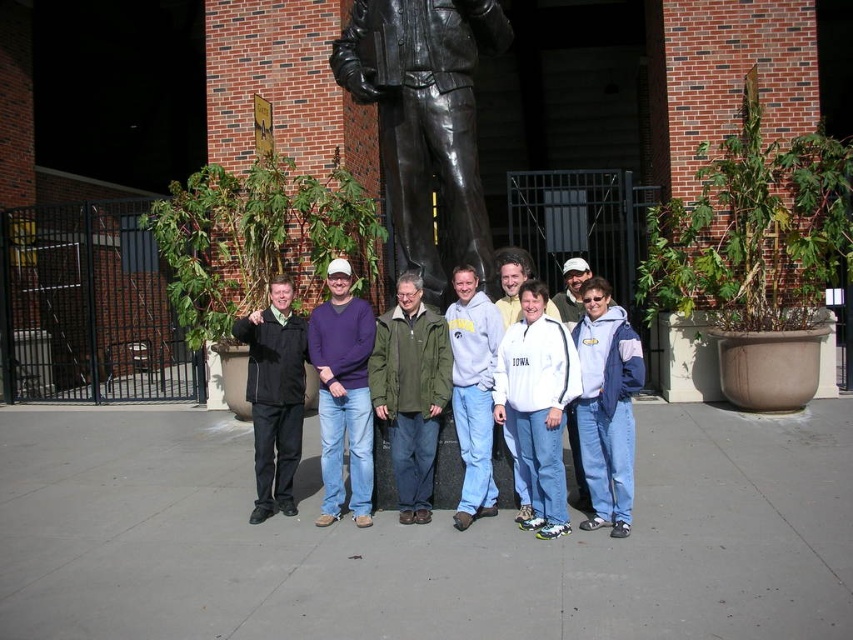
Question: Is white fleece jacket at center thinner than purple sweater at center?

Choices:
 (A) yes
 (B) no

Answer: (A)

Question: Based on their relative distances, which object is farther from the purple sweater at center?

Choices:
 (A) black matte jacket at center
 (B) bronze statue at center

Answer: (B)

Question: Does bronze statue at center come in front of white fleece jacket at center?

Choices:
 (A) no
 (B) yes

Answer: (A)

Question: Which point appears farthest from the camera in this image?

Choices:
 (A) 611,332
 (B) 271,419
 (C) 509,268
 (D) 363,500

Answer: (B)

Question: Is white fleece jacket at center wider than purple sweater at center?

Choices:
 (A) no
 (B) yes

Answer: (A)

Question: Considering the real-world distances, which object is farthest from the white matte jacket at center?

Choices:
 (A) black matte jacket at center
 (B) bronze statue at center
 (C) purple sweater at center

Answer: (A)